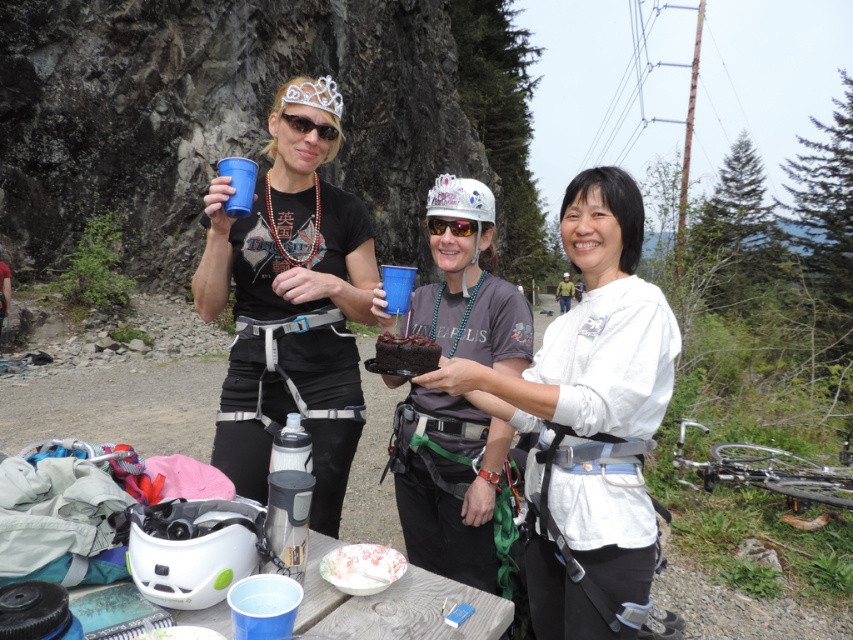
Who is lower down, chocolate cake at center or black plastic goggles at center?

chocolate cake at center is below.

Is point (386, 342) closer to camera compared to point (434, 218)?

That is True.

Locate an element on the screen. The height and width of the screenshot is (640, 853). chocolate cake at center is located at coordinates (403, 355).

Who is positioned more to the right, white matte helmet at center or chocolate cake at center?

white matte helmet at center

Can you confirm if white matte helmet at center is thinner than chocolate cake at center?

Incorrect, white matte helmet at center's width is not less than chocolate cake at center's.

Identify the location of white matte helmet at center. The width and height of the screenshot is (853, 640). (589, 420).

Identify the location of white matte helmet at center. The height and width of the screenshot is (640, 853). (589, 420).

Is white matte helmet at center further to the viewer compared to black plastic goggles at center?

No.

Which is in front, point (595, 458) or point (442, 220)?

Point (595, 458) is in front.

Identify the location of white matte helmet at center. (589, 420).